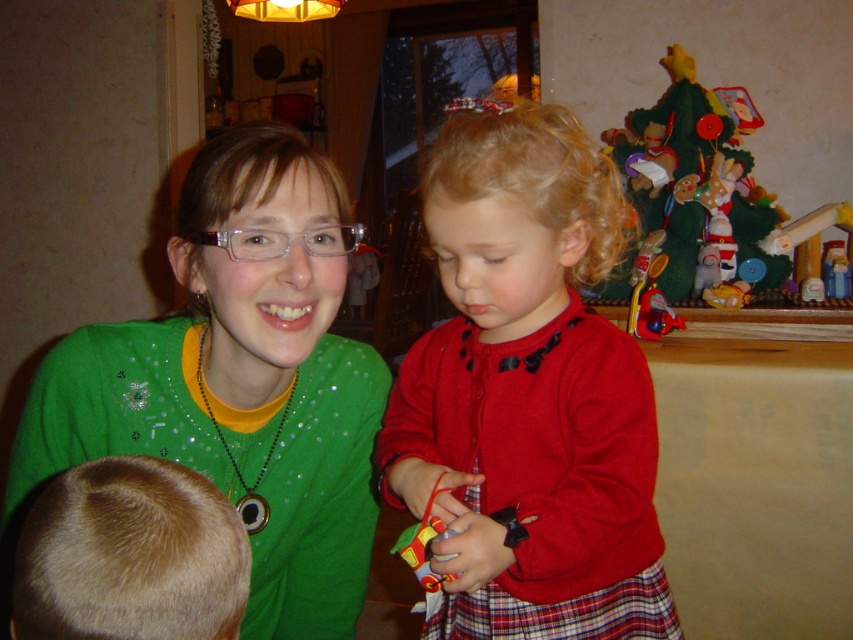
Question: In this image, where is green sparkly sweater at upper left located relative to clear plastic glasses at center?

Choices:
 (A) above
 (B) below

Answer: (B)

Question: Does green sparkly sweater at upper left lie behind clear plastic glasses at center?

Choices:
 (A) no
 (B) yes

Answer: (B)

Question: Does felt christmas tree at upper right have a larger size compared to clear plastic glasses at center?

Choices:
 (A) no
 (B) yes

Answer: (B)

Question: Based on their relative distances, which object is farther from the matte red sweater at center?

Choices:
 (A) felt christmas tree at upper right
 (B) green sparkly sweater at upper left

Answer: (A)

Question: Among these objects, which one is nearest to the camera?

Choices:
 (A) felt christmas tree at upper right
 (B) clear plastic glasses at center

Answer: (B)

Question: Considering the real-world distances, which object is closest to the blonde hair at lower left?

Choices:
 (A) matte red sweater at center
 (B) felt christmas tree at upper right
 (C) clear plastic glasses at center
 (D) green sparkly sweater at upper left

Answer: (A)